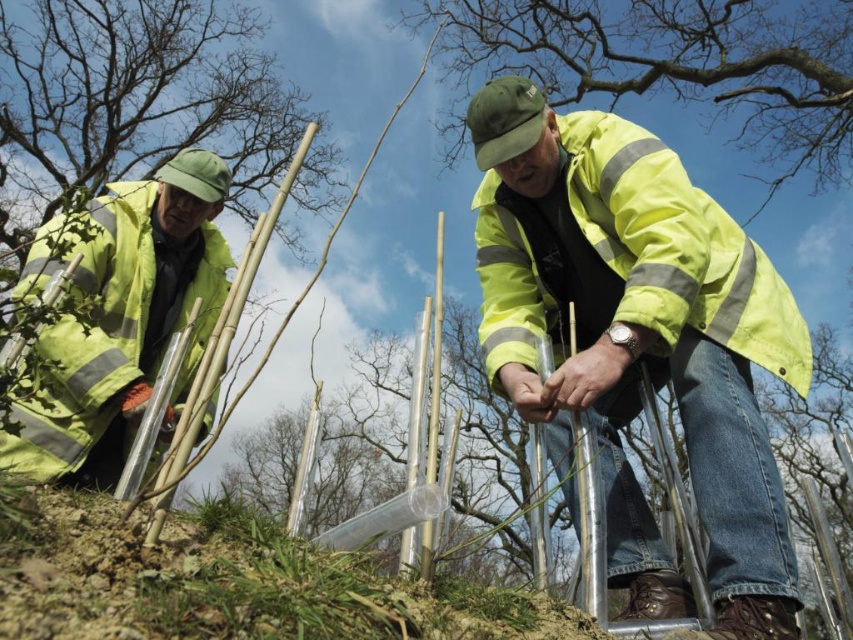
Between high-visibility yellow jacket at center and high visibility yellow jacket at left, which one has less height?

Standing shorter between the two is high-visibility yellow jacket at center.

Image resolution: width=853 pixels, height=640 pixels. I want to click on high-visibility yellow jacket at center, so click(675, 250).

Is yellow reflective jacket at center to the right of high visibility yellow jacket at left from the viewer's perspective?

Yes, yellow reflective jacket at center is to the right of high visibility yellow jacket at left.

Does point (643, 88) lie behind point (138, 298)?

Yes, it is.

This screenshot has height=640, width=853. Identify the location of yellow reflective jacket at center. (679, 65).

Where is `yellow reflective jacket at center`? yellow reflective jacket at center is located at coordinates (679, 65).

Does yellow reflective jacket at center have a greater height compared to high-visibility yellow jacket at center?

Yes, yellow reflective jacket at center is taller than high-visibility yellow jacket at center.

Where is `yellow reflective jacket at center`? This screenshot has width=853, height=640. yellow reflective jacket at center is located at coordinates (679, 65).